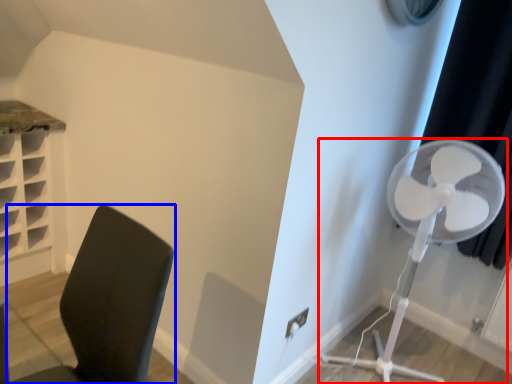
Question: Which of the following is the farthest to the observer, mechanical fan (highlighted by a red box) or furniture (highlighted by a blue box)?

Choices:
 (A) mechanical fan
 (B) furniture

Answer: (A)